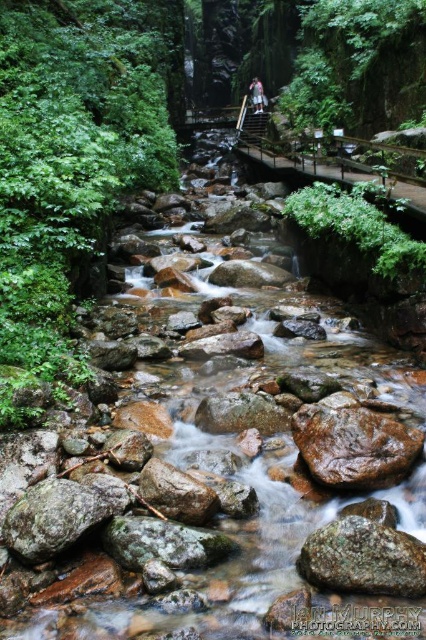
Consider the image. You are a hiker standing at the edge of the stream and see the brown rough rock at center and the rusty metallic rock at center. Which rock is closer to you?

The brown rough rock at center is closer to you because it is positioned further to the viewer than the rusty metallic rock at center.

You are standing in the forest and see the smooth brown rock at center and the white fabric shirt at center. Which object is positioned to the left from your perspective?

The smooth brown rock at center is to the left of the white fabric shirt at center.

You are a hiker who wants to cross the stream at the center. You see the brown rough rock at center and the green mossy rock at center. Which rock should you step on to avoid slipping?

The brown rough rock at center is taller than the green mossy rock at center, so stepping on the brown rough rock at center would provide a more stable and less slippery surface due to its rough texture.